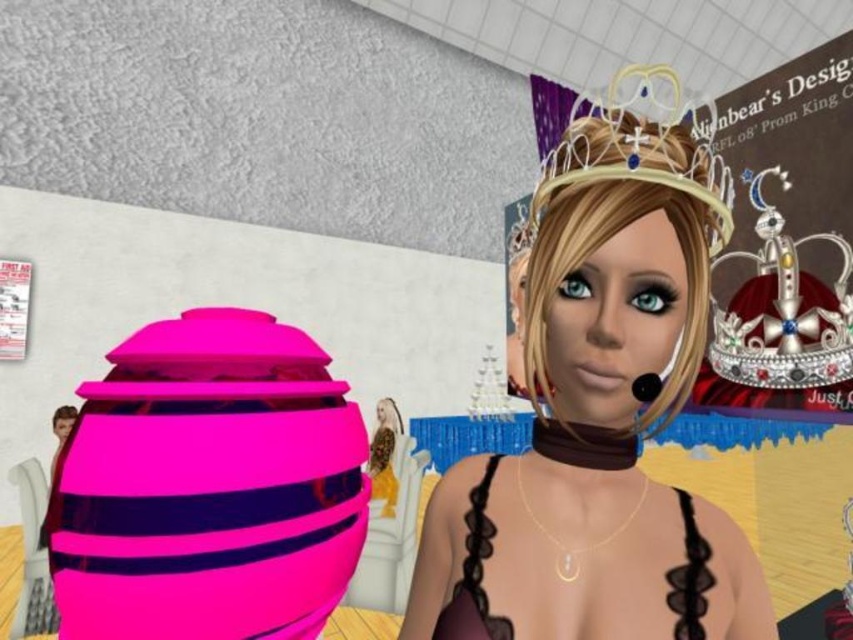
From the picture: Which of these two, shiny silver crown at upper center or matte purple dress at center, stands taller?

shiny silver crown at upper center

Is shiny silver crown at upper center further to the viewer compared to matte purple dress at center?

Yes.

Find the location of a particular element. The image size is (853, 640). shiny silver crown at upper center is located at coordinates (639, 147).

Is point (740, 360) positioned behind point (483, 484)?

Yes.

Is silver metallic crown at upper center wider than matte purple dress at center?

No, silver metallic crown at upper center is not wider than matte purple dress at center.

Image resolution: width=853 pixels, height=640 pixels. I want to click on silver metallic crown at upper center, so [782, 308].

I want to click on silver metallic crown at upper center, so click(x=782, y=308).

Is point (637, 244) positioned before point (672, 118)?

Yes, point (637, 244) is closer to viewer.

Between shiny plastic crown at upper center and shiny silver crown at upper center, which one appears on the right side from the viewer's perspective?

Positioned to the right is shiny plastic crown at upper center.

This screenshot has height=640, width=853. What are the coordinates of `shiny plastic crown at upper center` in the screenshot? It's located at (599, 413).

At what (x,y) coordinates should I click in order to perform the action: click on shiny plastic crown at upper center. Please return your answer as a coordinate pair (x, y). This screenshot has height=640, width=853. Looking at the image, I should click on (599, 413).